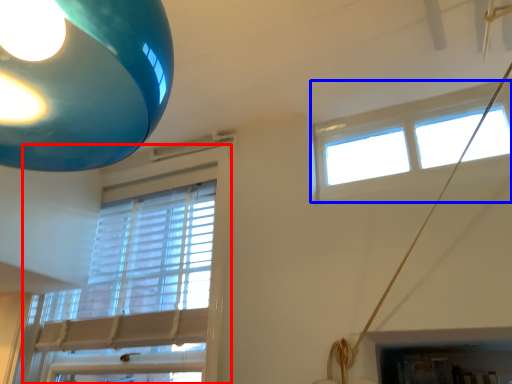
Question: Among these objects, which one is farthest to the camera, window (highlighted by a red box) or window (highlighted by a blue box)?

Choices:
 (A) window
 (B) window

Answer: (A)